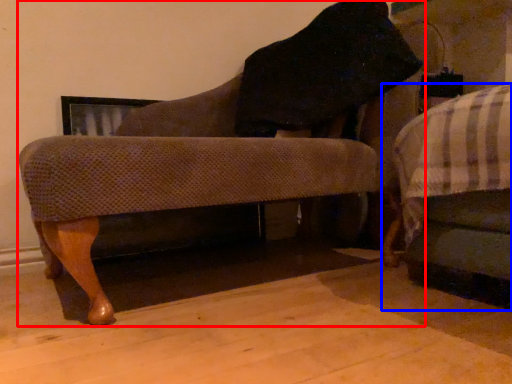
Question: Which object is closer to the camera taking this photo, chair (highlighted by a red box) or furniture (highlighted by a blue box)?

Choices:
 (A) chair
 (B) furniture

Answer: (A)